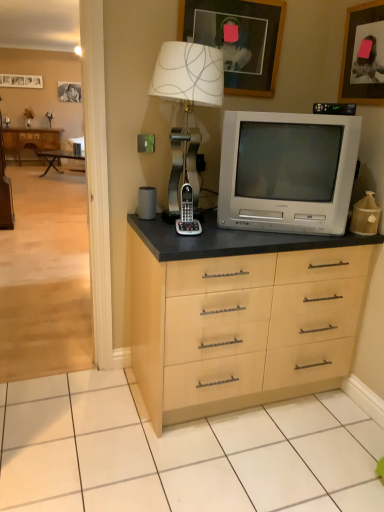
Question: Can you confirm if wooden photo frame at upper left, positioned as the 1th picture frame in back-to-front order, is thinner than wooden picture frame at upper center, acting as the second picture frame starting from the front?

Choices:
 (A) yes
 (B) no

Answer: (B)

Question: Is wooden photo frame at upper left, the third picture frame positioned from the front, positioned behind wooden picture frame at upper center, acting as the second picture frame starting from the bottom?

Choices:
 (A) yes
 (B) no

Answer: (A)

Question: Is wooden photo frame at upper left, which is the 1th picture frame in left-to-right order, far away from wooden picture frame at upper center, the second picture frame from the left?

Choices:
 (A) yes
 (B) no

Answer: (A)

Question: Considering the relative sizes of wooden photo frame at upper left, positioned as the 1th picture frame in back-to-front order, and wooden picture frame at upper center, acting as the second picture frame starting from the front, in the image provided, is wooden photo frame at upper left, positioned as the 1th picture frame in back-to-front order, taller than wooden picture frame at upper center, acting as the second picture frame starting from the front,?

Choices:
 (A) yes
 (B) no

Answer: (B)

Question: From the image's perspective, is wooden photo frame at upper left, which is the third picture frame in right-to-left order, above wooden picture frame at upper center, acting as the second picture frame starting from the bottom?

Choices:
 (A) no
 (B) yes

Answer: (B)

Question: Is wooden picture frame at upper right, the 1th picture frame in the front-to-back sequence, to the left or to the right of brown wood desk at left in the image?

Choices:
 (A) right
 (B) left

Answer: (A)

Question: Do you think wooden picture frame at upper right, the first picture frame ordered from the bottom, is within brown wood desk at left, or outside of it?

Choices:
 (A) outside
 (B) inside

Answer: (A)

Question: Considering the positions of wooden picture frame at upper right, which is the third picture frame from left to right, and brown wood desk at left in the image, is wooden picture frame at upper right, which is the third picture frame from left to right, taller or shorter than brown wood desk at left?

Choices:
 (A) short
 (B) tall

Answer: (A)

Question: From a real-world perspective, relative to brown wood desk at left, is wooden picture frame at upper right, acting as the 3th picture frame starting from the top, vertically above or below?

Choices:
 (A) below
 (B) above

Answer: (B)

Question: Choose the correct answer: Is silver metallic television at center inside satin silver table lamp at upper center or outside it?

Choices:
 (A) inside
 (B) outside

Answer: (B)

Question: From the image's perspective, is silver metallic television at center above or below satin silver table lamp at upper center?

Choices:
 (A) above
 (B) below

Answer: (B)

Question: In terms of size, does silver metallic television at center appear bigger or smaller than satin silver table lamp at upper center?

Choices:
 (A) big
 (B) small

Answer: (A)

Question: In terms of width, does silver metallic television at center look wider or thinner when compared to satin silver table lamp at upper center?

Choices:
 (A) thin
 (B) wide

Answer: (A)

Question: Choose the correct answer: Is satin silver table lamp at upper center inside brown wood desk at left or outside it?

Choices:
 (A) outside
 (B) inside

Answer: (A)

Question: In the image, is satin silver table lamp at upper center positioned in front of or behind brown wood desk at left?

Choices:
 (A) front
 (B) behind

Answer: (A)